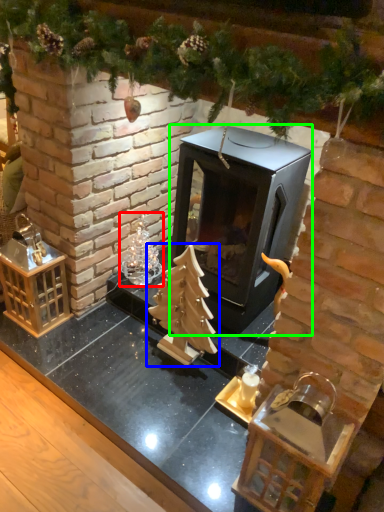
Question: Which object is the farthest from christmas decoration (highlighted by a red box)? Choose among these: christmas tree (highlighted by a blue box) or fireplace (highlighted by a green box).

Choices:
 (A) christmas tree
 (B) fireplace

Answer: (B)